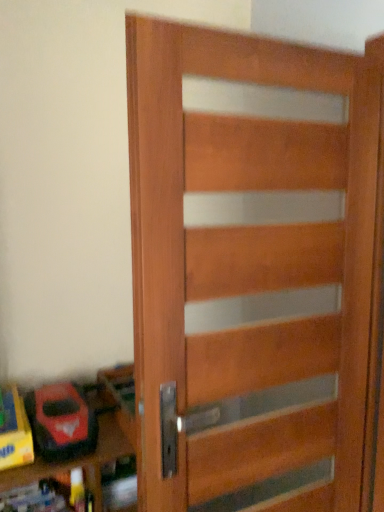
Question: From a real-world perspective, is rubberized red toy car at lower left located higher than wooden door at center?

Choices:
 (A) yes
 (B) no

Answer: (B)

Question: Is rubberized red toy car at lower left positioned in front of wooden door at center?

Choices:
 (A) no
 (B) yes

Answer: (A)

Question: Can we say rubberized red toy car at lower left lies outside wooden door at center?

Choices:
 (A) yes
 (B) no

Answer: (A)

Question: Considering the relative sizes of rubberized red toy car at lower left and wooden door at center in the image provided, is rubberized red toy car at lower left thinner than wooden door at center?

Choices:
 (A) yes
 (B) no

Answer: (B)

Question: Is rubberized red toy car at lower left shorter than wooden door at center?

Choices:
 (A) no
 (B) yes

Answer: (B)

Question: Is wooden door at center located within rubberized red toy car at lower left?

Choices:
 (A) no
 (B) yes

Answer: (A)

Question: Could wooden door at center be considered to be inside wooden toy box at lower left?

Choices:
 (A) no
 (B) yes

Answer: (A)

Question: Does wooden toy box at lower left lie behind wooden door at center?

Choices:
 (A) yes
 (B) no

Answer: (A)

Question: From the image's perspective, would you say wooden toy box at lower left is shown under wooden door at center?

Choices:
 (A) no
 (B) yes

Answer: (B)

Question: Is wooden toy box at lower left wider than wooden door at center?

Choices:
 (A) yes
 (B) no

Answer: (A)

Question: Is wooden toy box at lower left closer to the viewer compared to wooden door at center?

Choices:
 (A) no
 (B) yes

Answer: (A)

Question: Does wooden toy box at lower left have a lesser height compared to wooden door at center?

Choices:
 (A) yes
 (B) no

Answer: (A)

Question: From the image's perspective, is wooden door at center located above wooden toy box at lower left?

Choices:
 (A) yes
 (B) no

Answer: (A)